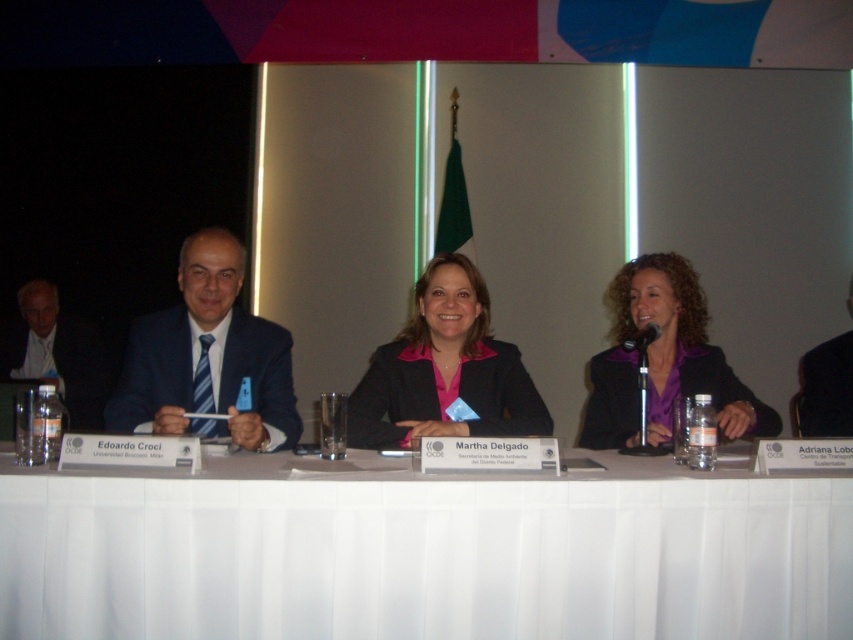
Can you confirm if purple matte blazer at center is shorter than black fabric suit at right?

No, purple matte blazer at center is not shorter than black fabric suit at right.

Which of these two, purple matte blazer at center or black fabric suit at right, stands shorter?

Standing shorter between the two is black fabric suit at right.

Locate an element on the screen. purple matte blazer at center is located at coordinates (663, 360).

Locate an element on the screen. The width and height of the screenshot is (853, 640). purple matte blazer at center is located at coordinates (663, 360).

Can you confirm if matte black blazer at center is taller than purple matte blazer at center?

Answer: No.

Which is behind, point (469, 419) or point (741, 385)?

Point (741, 385)

Find the location of a particular element. Image resolution: width=853 pixels, height=640 pixels. matte black blazer at center is located at coordinates (445, 369).

Is matte black blazer at center thinner than black fabric suit at right?

No, matte black blazer at center is not thinner than black fabric suit at right.

Is matte black blazer at center to the right of black fabric suit at right from the viewer's perspective?

No, matte black blazer at center is not to the right of black fabric suit at right.

What do you see at coordinates (445, 369) in the screenshot? The width and height of the screenshot is (853, 640). I see `matte black blazer at center` at bounding box center [445, 369].

I want to click on matte black blazer at center, so click(x=445, y=369).